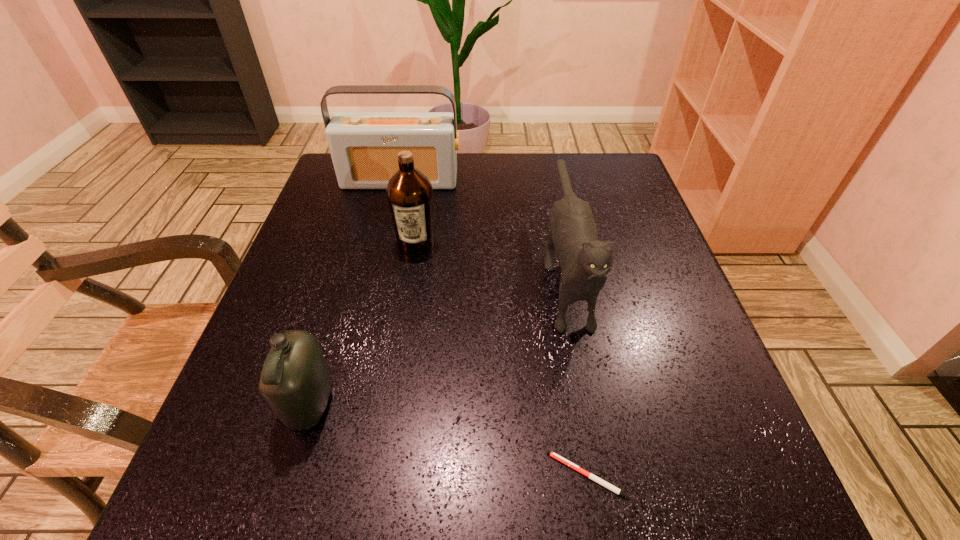
I want to click on unoccupied area between the olive oil and the cat, so click(491, 257).

Where is `blank region between the pen and the olive oil`? This screenshot has width=960, height=540. blank region between the pen and the olive oil is located at coordinates (502, 359).

This screenshot has height=540, width=960. Find the location of `object identified as the closest to the fourth farthest object`. object identified as the closest to the fourth farthest object is located at coordinates (409, 192).

This screenshot has width=960, height=540. In order to click on the third closest object to the farthest object in this screenshot , I will do `click(295, 381)`.